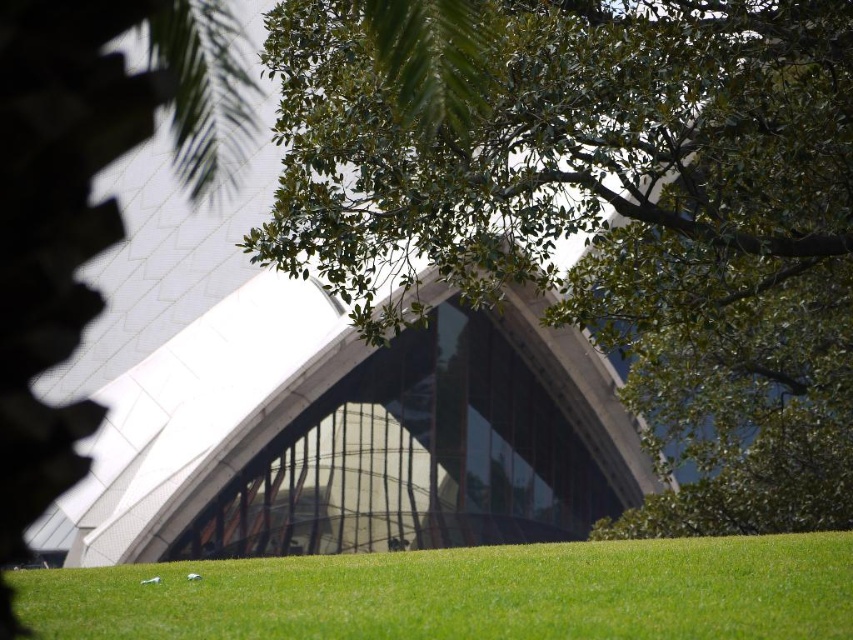
You are a landscape architect evaluating the Sydney Opera House grounds. You notice the green leafy tree at center and the green grass at lower center. Which object occupies a larger area in the scene?

The green leafy tree at center is bigger than the green grass at lower center, so the tree occupies a larger area in the scene.

You are standing at the edge of the green grass at lower center and want to walk towards the Sydney Opera House. Which direction should you head relative to the green leafy tree at center?

You should head to the left of the green leafy tree at center because the tree is positioned to the right of the green grass at lower center, so moving left would align you towards the opera house.

You are a photographer standing at the edge of the green grass at lower center, aiming to capture the Sydney Opera House in the background. However, you notice the green leafy tree at center might obstruct your view. Based on their positions, will the tree block the opera house in your photo?

The green leafy tree at center is in front of green grass at lower center, so it will block the view of the Sydney Opera House behind the grass in your photo.